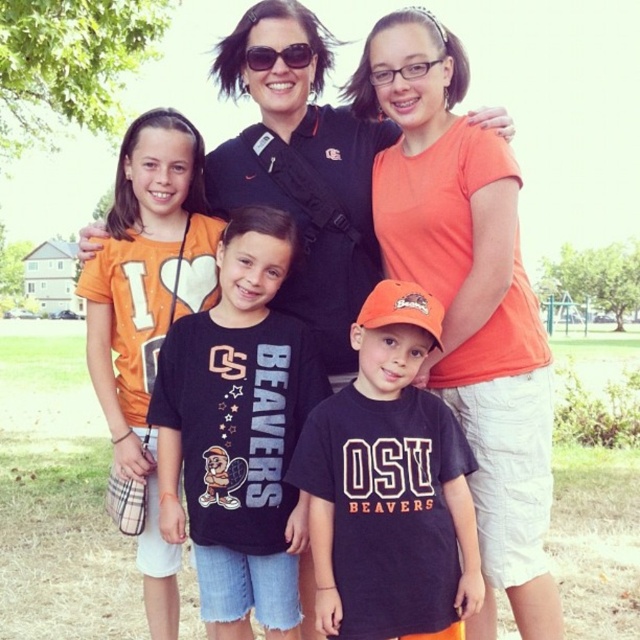
Question: Does dark blue cotton shirt at center have a larger size compared to black plastic sunglasses at upper center?

Choices:
 (A) yes
 (B) no

Answer: (A)

Question: Can you confirm if black cotton t-shirt at center is positioned below dark blue cotton shirt at center?

Choices:
 (A) no
 (B) yes

Answer: (A)

Question: Which point is farther to the camera?

Choices:
 (A) (477, 156)
 (B) (256, 477)
 (C) (444, 497)

Answer: (A)

Question: Among these objects, which one is farthest from the camera?

Choices:
 (A) black plastic sunglasses at upper center
 (B) orange cotton shirt at upper right
 (C) orange cotton shirt at left
 (D) dark blue cotton shirt at center

Answer: (A)

Question: From the image, what is the correct spatial relationship of orange cotton shirt at upper right in relation to orange cotton shirt at left?

Choices:
 (A) right
 (B) left

Answer: (A)

Question: Which object is positioned farthest from the black cotton t-shirt at center?

Choices:
 (A) dark blue cotton shirt at center
 (B) orange cotton shirt at upper right
 (C) black plastic sunglasses at upper center
 (D) orange cotton shirt at left

Answer: (C)